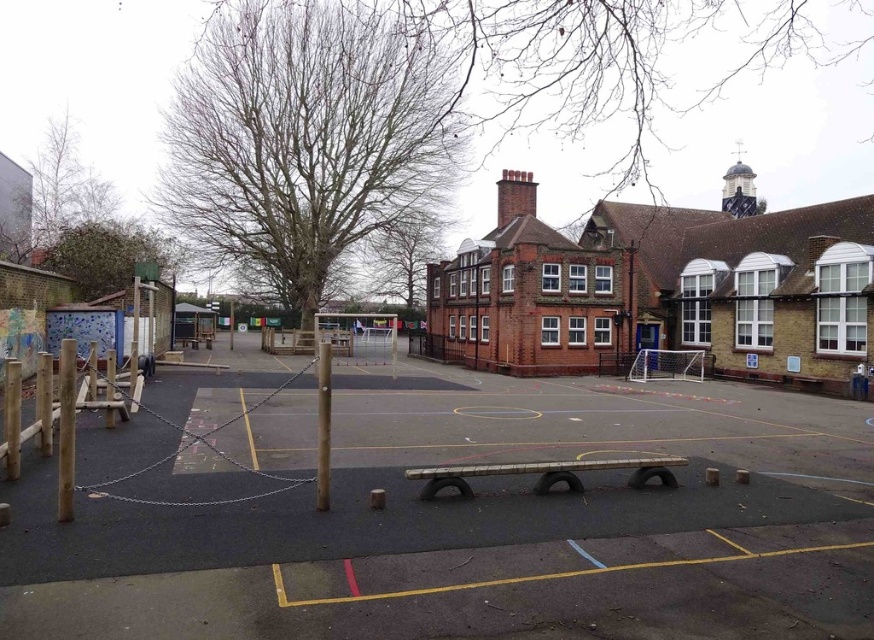
Question: Which object appears farthest from the camera in this image?

Choices:
 (A) wooden pole at center
 (B) smooth asphalt parking lot at center
 (C) wooden pole at left

Answer: (A)

Question: Does wooden pole at left appear on the left side of wooden pole at center?

Choices:
 (A) yes
 (B) no

Answer: (B)

Question: Does wooden pole at left have a greater width compared to wooden pole at center?

Choices:
 (A) no
 (B) yes

Answer: (A)

Question: In this image, where is smooth asphalt parking lot at center located relative to wooden pole at left?

Choices:
 (A) right
 (B) left

Answer: (A)

Question: Which of the following is the closest to the observer?

Choices:
 (A) (35, 628)
 (B) (60, 474)
 (C) (323, 467)

Answer: (A)

Question: Which is farther from the smooth asphalt parking lot at center?

Choices:
 (A) wooden pole at center
 (B) wooden pole at left

Answer: (B)